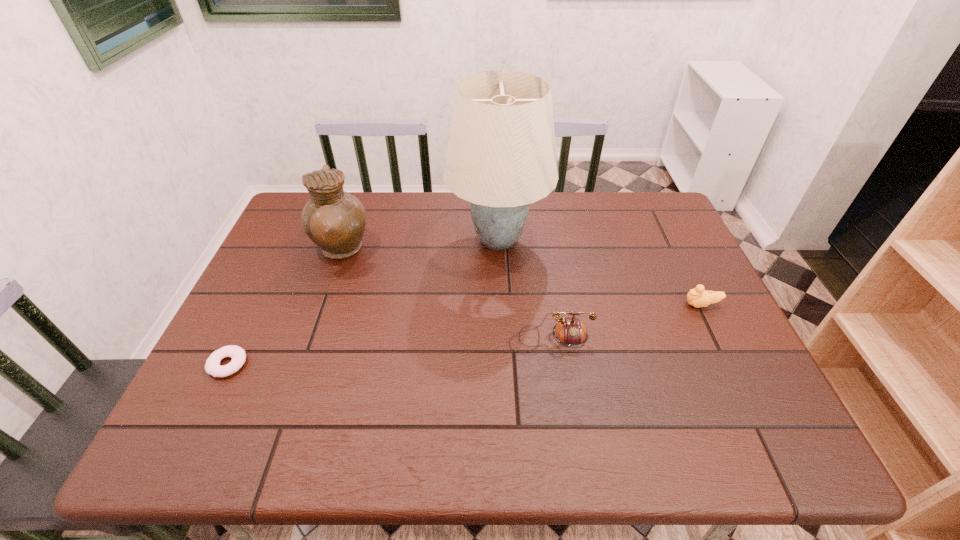
Image resolution: width=960 pixels, height=540 pixels. Identify the location of vacant space located on the rotary dial of the telephone. (562, 414).

Locate an element on the screen. vacant region located on the face of the third nearest object is located at coordinates (536, 305).

At what (x,y) coordinates should I click in order to perform the action: click on vacant space located on the face of the third nearest object. Please return your answer as a coordinate pair (x, y). The height and width of the screenshot is (540, 960). Looking at the image, I should click on (570, 305).

The image size is (960, 540). Identify the location of free point located on the face of the third nearest object. (653, 305).

Find the location of a particular element. The width and height of the screenshot is (960, 540). free spot located 0.250m on the back of the shortest object is located at coordinates (272, 275).

This screenshot has height=540, width=960. I want to click on lampshade at the far edge, so click(x=501, y=156).

You are a GUI agent. You are given a task and a screenshot of the screen. Output one action in this format:
    pyautogui.click(x=<x>, y=<y>)
    Task: Click on the pitcher that is at the far edge
    This screenshot has height=540, width=960.
    Given the screenshot: What is the action you would take?
    pyautogui.click(x=335, y=220)

At what (x,y) coordinates should I click in order to perform the action: click on pitcher located in the left edge section of the desktop. Please return your answer as a coordinate pair (x, y). Image resolution: width=960 pixels, height=540 pixels. Looking at the image, I should click on (335, 220).

Where is `doughnut that is at the left edge`? doughnut that is at the left edge is located at coordinates (212, 367).

Locate an element on the screen. This screenshot has height=540, width=960. object present at the right edge is located at coordinates (698, 297).